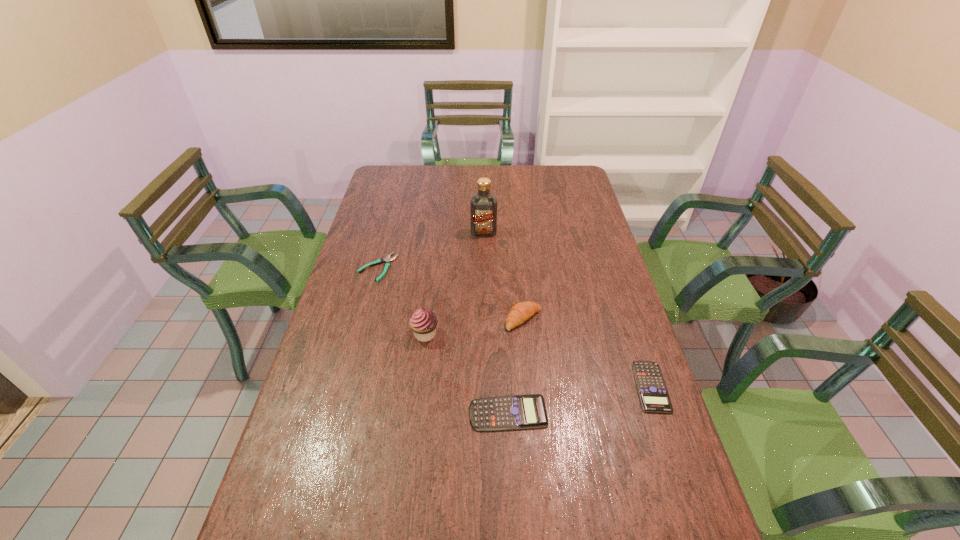
You are a GUI agent. You are given a task and a screenshot of the screen. Output one action in this format:
    pyautogui.click(x=<x>, y=<y>)
    Task: Click on the free space between the vodka and the second tallest object
    This screenshot has height=540, width=960.
    Given the screenshot: What is the action you would take?
    pyautogui.click(x=454, y=283)

Identify the location of free space between the right calculator and the crescent roll. This screenshot has width=960, height=540. (588, 353).

The height and width of the screenshot is (540, 960). What are the coordinates of `free space between the fourth shortest object and the rightmost object` in the screenshot? It's located at 588,353.

You are a GUI agent. You are given a task and a screenshot of the screen. Output one action in this format:
    pyautogui.click(x=<x>, y=<y>)
    Task: Click on the free space that is in between the second tallest object and the left calculator
    The width and height of the screenshot is (960, 540).
    Given the screenshot: What is the action you would take?
    pyautogui.click(x=467, y=374)

Point out which object is positioned as the second nearest to the second object from left to right. Please provide its 2D coordinates. Your answer should be formatted as a tuple, i.e. [(x, y)], where the tuple contains the x and y coordinates of a point satisfying the conditions above.

[(520, 312)]

Select which object is the closest to the shorter calculator. Please provide its 2D coordinates. Your answer should be formatted as a tuple, i.e. [(x, y)], where the tuple contains the x and y coordinates of a point satisfying the conditions above.

[(513, 412)]

The height and width of the screenshot is (540, 960). In order to click on free space in the image that satisfies the following two spatial constraints: 1. on the back side of the taller calculator; 2. on the left side of the rightmost object in this screenshot , I will do `click(507, 387)`.

At what (x,y) coordinates should I click in order to perform the action: click on free space that satisfies the following two spatial constraints: 1. on the front-facing side of the vodka; 2. on the left side of the shorter calculator. Please return your answer as a coordinate pair (x, y). Looking at the image, I should click on (485, 387).

Locate an element on the screen. This screenshot has width=960, height=540. vacant space that satisfies the following two spatial constraints: 1. on the front side of the second object from left to right; 2. on the right side of the pliers is located at coordinates (360, 334).

Image resolution: width=960 pixels, height=540 pixels. I want to click on free space in the image that satisfies the following two spatial constraints: 1. on the front side of the right calculator; 2. on the left side of the cupcake, so click(x=419, y=387).